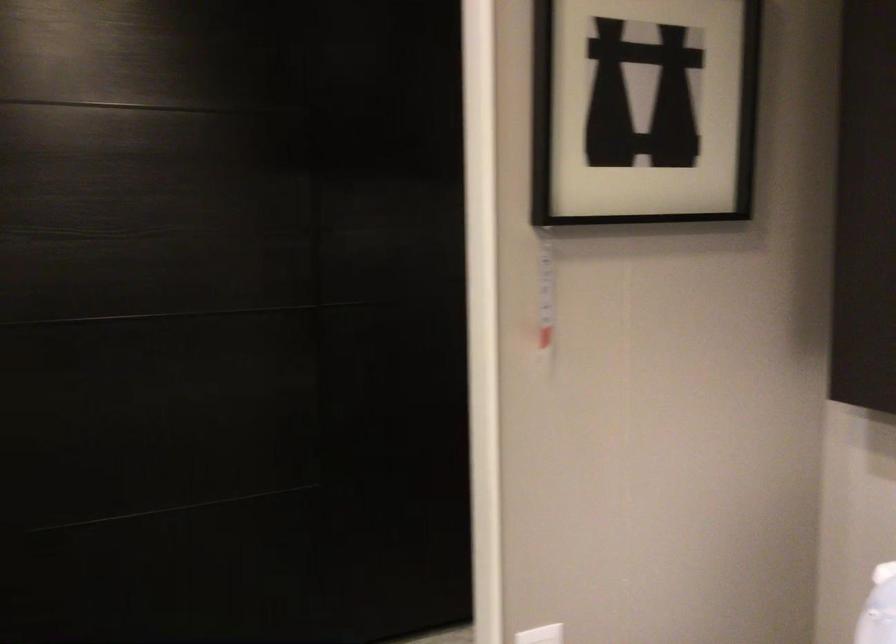
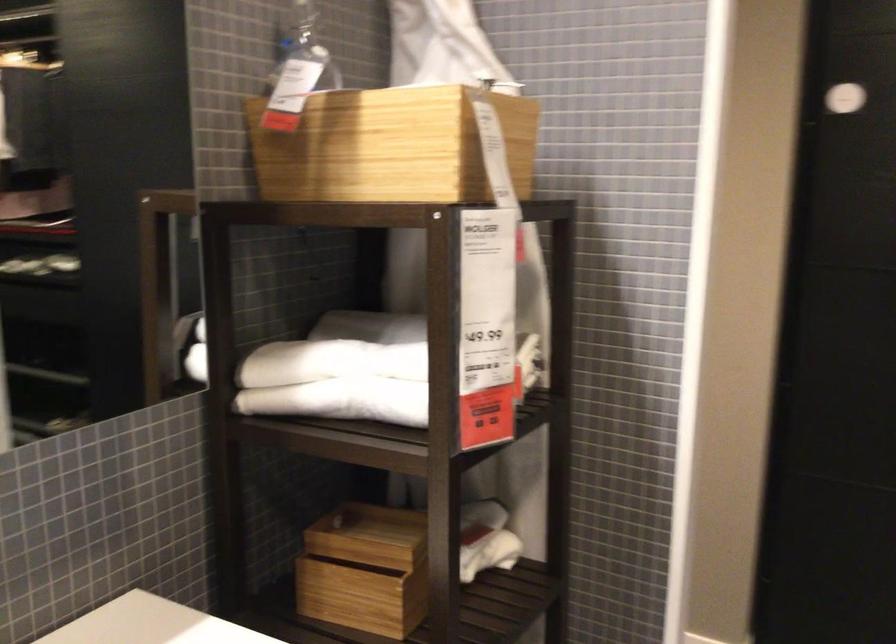
Question: The camera is either moving clockwise (left) or counter-clockwise (right) around the object. The first image is from the beginning of the video and the second image is from the end. Is the camera moving left or right when shooting the video?

Choices:
 (A) Left
 (B) Right

Answer: (B)